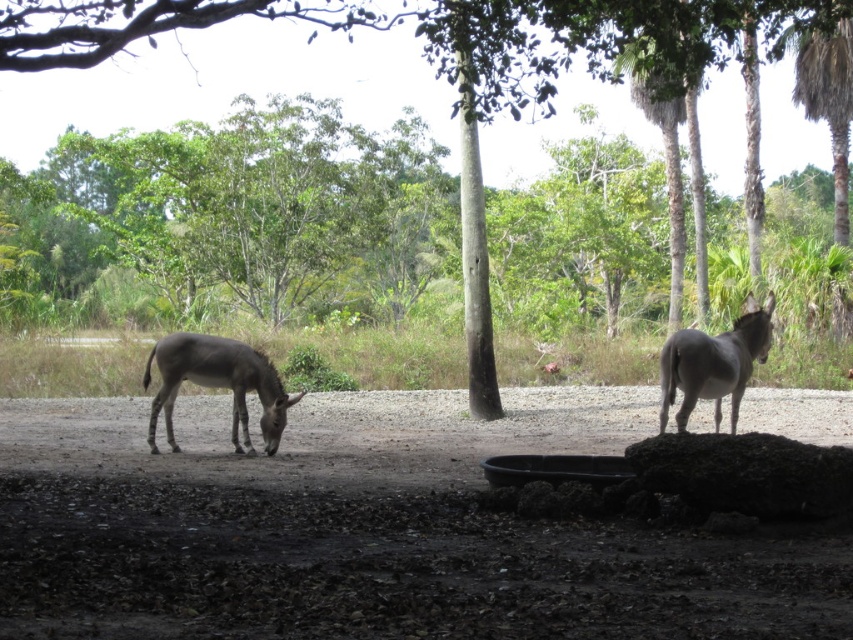
Question: Can you confirm if dark brown dirt field at center is positioned above gray matte donkey at left?

Choices:
 (A) yes
 (B) no

Answer: (B)

Question: Among these points, which one is farthest from the camera?

Choices:
 (A) (660, 413)
 (B) (370, 12)
 (C) (196, 364)

Answer: (B)

Question: Is gray matte donkey at left smaller than gray matte donkey at right?

Choices:
 (A) yes
 (B) no

Answer: (B)

Question: Which point is closer to the camera taking this photo?

Choices:
 (A) (248, 442)
 (B) (686, 360)

Answer: (B)

Question: Can you confirm if dark brown dirt field at center is positioned below gray matte donkey at left?

Choices:
 (A) yes
 (B) no

Answer: (A)

Question: Which of the following is the closest to the observer?

Choices:
 (A) dark brown dirt field at center
 (B) brown smooth tree at center

Answer: (A)